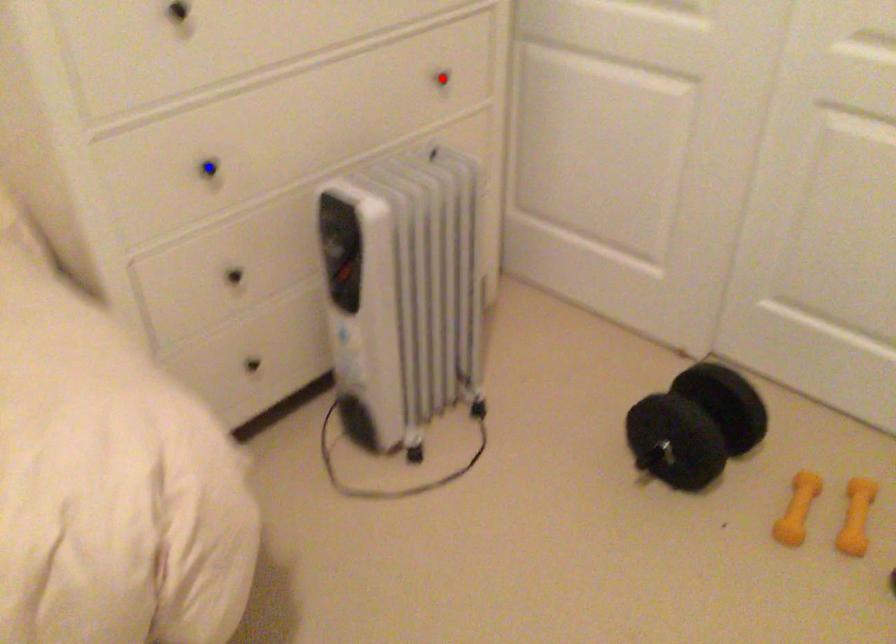
Question: Two points are marked on the image. Which point is closer to the camera?

Choices:
 (A) Blue point is closer.
 (B) Red point is closer.

Answer: (A)